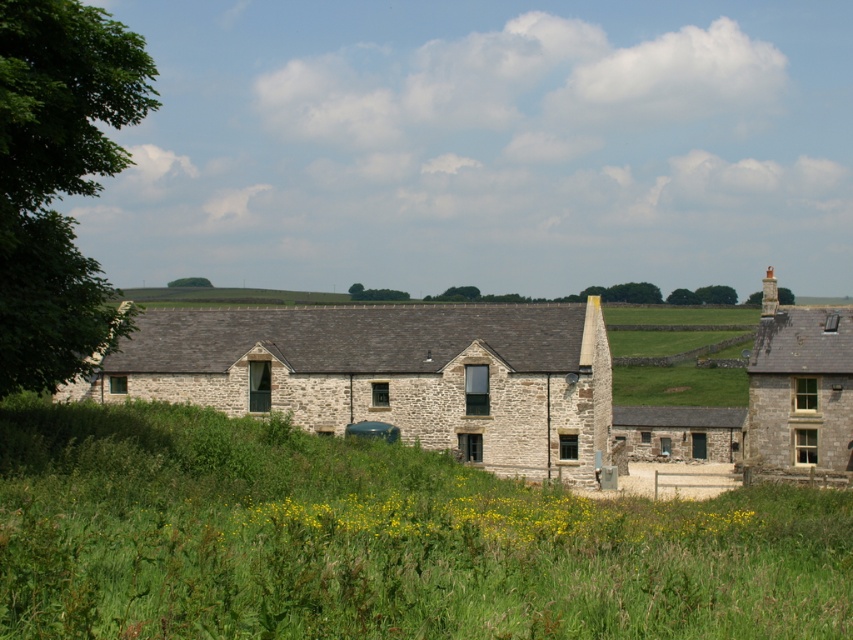
Question: Does green grassy field at center have a lesser width compared to stone chimney at upper right?

Choices:
 (A) yes
 (B) no

Answer: (B)

Question: Is green grassy field at center to the right of stone chimney at upper right from the viewer's perspective?

Choices:
 (A) yes
 (B) no

Answer: (B)

Question: Which object appears closest to the camera in this image?

Choices:
 (A) stone cottage at center
 (B) stone chimney at upper right
 (C) green grassy field at center

Answer: (C)

Question: Which point is closer to the camera taking this photo?

Choices:
 (A) (776, 285)
 (B) (166, 330)

Answer: (A)

Question: Among these objects, which one is farthest from the camera?

Choices:
 (A) green grassy field at center
 (B) stone chimney at upper right
 (C) stone cottage at center

Answer: (C)

Question: Is green grassy field at center bigger than smooth gray chimney at upper right?

Choices:
 (A) yes
 (B) no

Answer: (B)